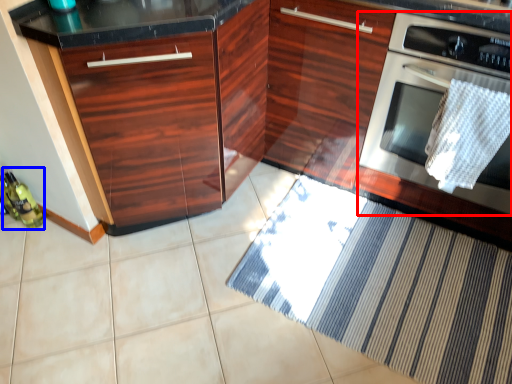
Question: Which of the following is the closest to the observer, home appliance (highlighted by a red box) or bottle (highlighted by a blue box)?

Choices:
 (A) home appliance
 (B) bottle

Answer: (A)